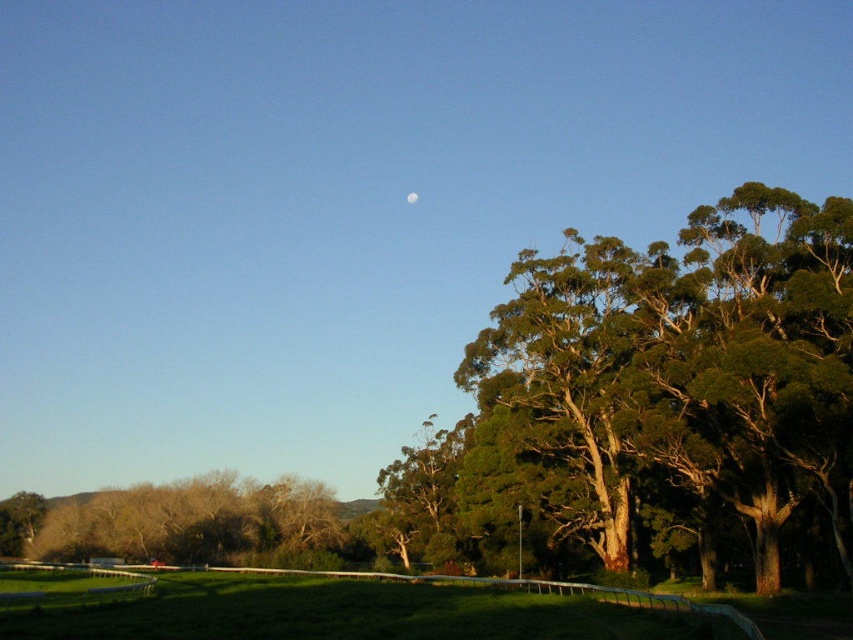
Who is lower down, green textured tree at upper right or green leafy tree at lower left?

green leafy tree at lower left is lower down.

Does point (810, 516) come behind point (305, 484)?

No, (810, 516) is in front of (305, 484).

Who is more forward, (482, 477) or (190, 499)?

Point (482, 477)

Where is `green textured tree at upper right`? The height and width of the screenshot is (640, 853). green textured tree at upper right is located at coordinates (656, 404).

The image size is (853, 640). Find the location of `green textured tree at upper right`. green textured tree at upper right is located at coordinates 656,404.

Does point (540, 352) come closer to viewer compared to point (415, 196)?

Yes.

Does point (502, 552) lie in front of point (405, 195)?

Yes, it is.

Image resolution: width=853 pixels, height=640 pixels. What are the coordinates of `green textured tree at upper right` in the screenshot? It's located at (656, 404).

Which is behind, point (125, 531) or point (405, 195)?

The point (405, 195) is behind.

Is green leafy tree at lower left further to camera compared to white glossy moon at upper center?

No, green leafy tree at lower left is closer to the viewer.

At what (x,y) coordinates should I click in order to perform the action: click on green leafy tree at lower left. Please return your answer as a coordinate pair (x, y). The width and height of the screenshot is (853, 640). Looking at the image, I should click on (190, 520).